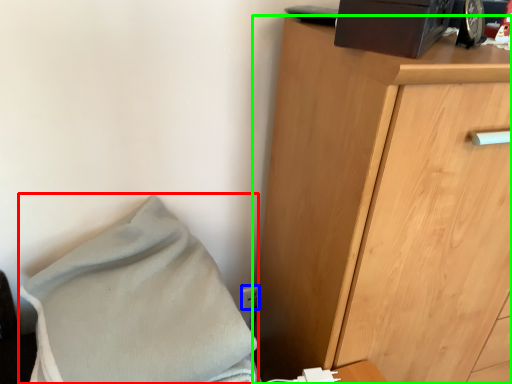
Question: Which object is the closest to the blanket (highlighted by a red box)? Choose among these: electric outlet (highlighted by a blue box) or chest of drawers (highlighted by a green box).

Choices:
 (A) electric outlet
 (B) chest of drawers

Answer: (B)